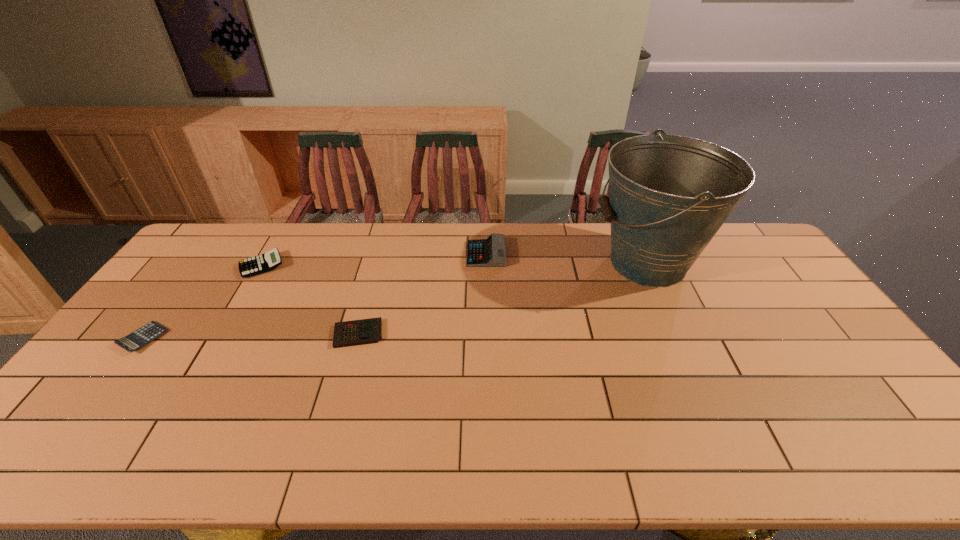
You are a GUI agent. You are given a task and a screenshot of the screen. Output one action in this format:
    pyautogui.click(x=<x>, y=<y>)
    Task: Click on the bucket
    The height and width of the screenshot is (540, 960).
    Given the screenshot: What is the action you would take?
    pyautogui.click(x=669, y=195)

I want to click on the rightmost object, so click(669, 195).

Identify the location of the rightmost calculator. The image size is (960, 540). (491, 252).

The height and width of the screenshot is (540, 960). In order to click on the second object from right to left in this screenshot , I will do `click(491, 252)`.

The width and height of the screenshot is (960, 540). I want to click on the second calculator from left to right, so click(270, 260).

Where is `the second tallest calculator`? The height and width of the screenshot is (540, 960). the second tallest calculator is located at coordinates (270, 260).

Find the location of a particular element. the third calculator from left to right is located at coordinates (365, 331).

The image size is (960, 540). Identify the location of the third object from right to left. (365, 331).

I want to click on the leftmost calculator, so click(141, 337).

Locate an element on the screen. Image resolution: width=960 pixels, height=540 pixels. the shortest object is located at coordinates (141, 337).